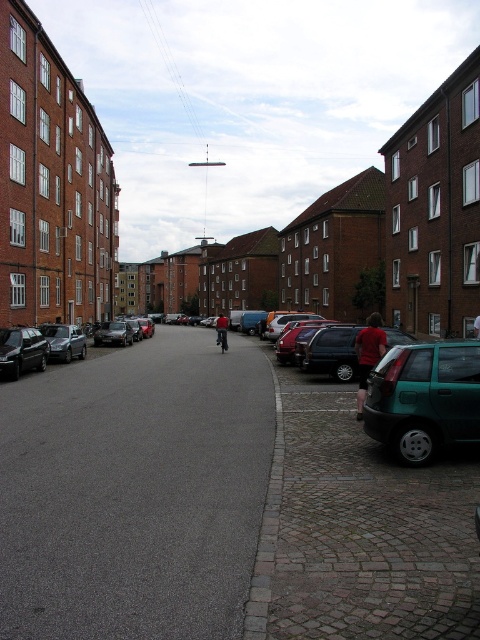
Question: Is matte black car at center smaller than red cotton shirt at center?

Choices:
 (A) yes
 (B) no

Answer: (A)

Question: Which object is the closest to the teal matte hatchback at right?

Choices:
 (A) red fabric shirt at right
 (B) shiny black sedan at left
 (C) matte silver sedan at left
 (D) red cotton shirt at center

Answer: (A)

Question: Which object is the farthest from the red fabric shirt at right?

Choices:
 (A) matte silver sedan at left
 (B) red cotton shirt at center
 (C) matte black car at center

Answer: (C)

Question: Is matte black car at center bigger than red cotton shirt at center?

Choices:
 (A) no
 (B) yes

Answer: (A)

Question: Which object is the farthest from the red cotton shirt at center?

Choices:
 (A) matte black car at center
 (B) shiny black sedan at left
 (C) red fabric shirt at right
 (D) teal matte hatchback at right

Answer: (D)

Question: From the image, what is the correct spatial relationship of teal matte hatchback at right in relation to red cotton shirt at center?

Choices:
 (A) above
 (B) below

Answer: (B)